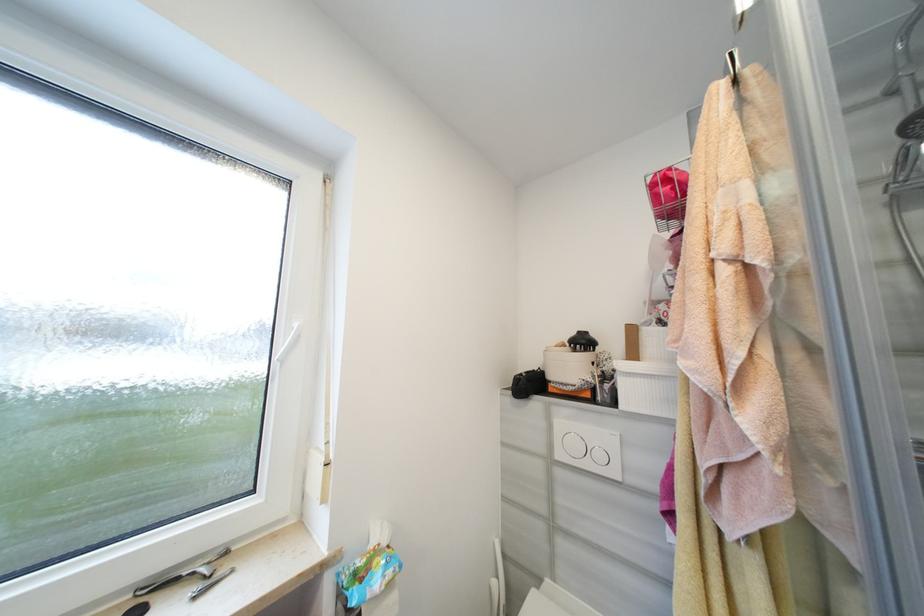
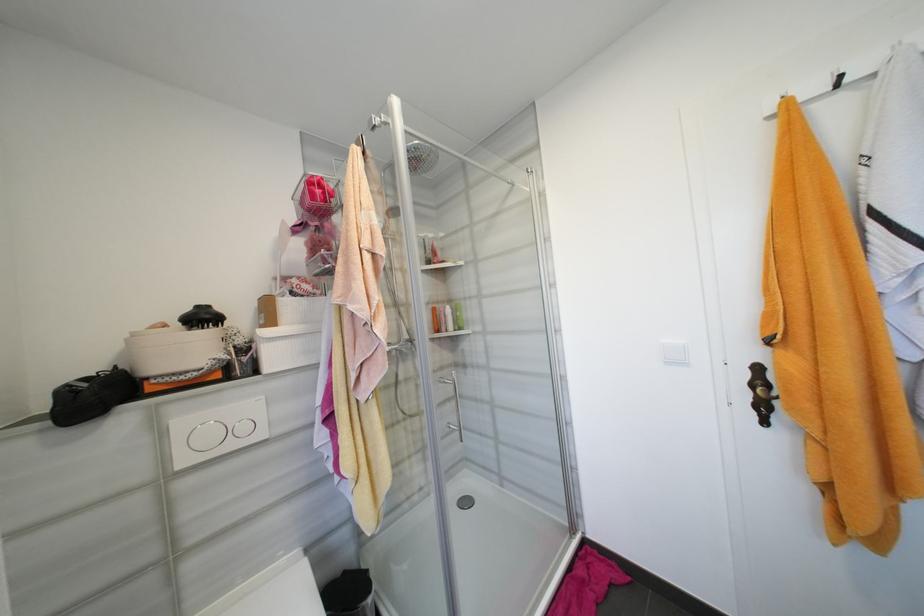
Locate, in the second image, the point that corresponds to point 604,456 in the first image.

(249, 429)